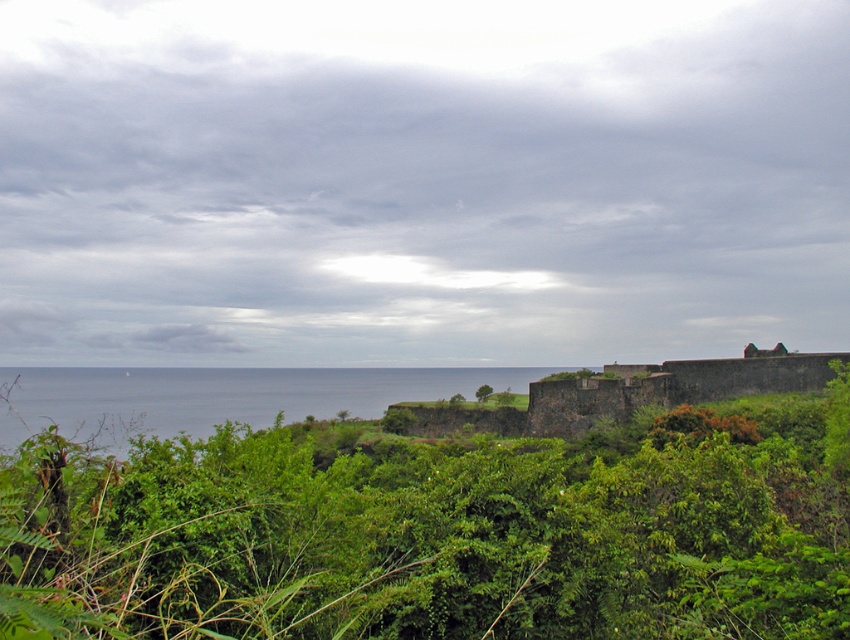
Question: Based on their relative distances, which object is farther from the blue water at center?

Choices:
 (A) green leafy tree at center
 (B) green leafy shrubs at center

Answer: (A)

Question: Can you confirm if green leafy shrubs at center is thinner than green leafy tree at center?

Choices:
 (A) no
 (B) yes

Answer: (A)

Question: Can you confirm if green leafy shrubs at center is smaller than blue water at center?

Choices:
 (A) yes
 (B) no

Answer: (A)

Question: Which of the following is the farthest from the observer?

Choices:
 (A) (639, 540)
 (B) (476, 397)

Answer: (B)

Question: Which object is the closest to the green leafy shrubs at center?

Choices:
 (A) green leafy tree at center
 (B) blue water at center

Answer: (A)

Question: Is green leafy shrubs at center bigger than blue water at center?

Choices:
 (A) no
 (B) yes

Answer: (A)